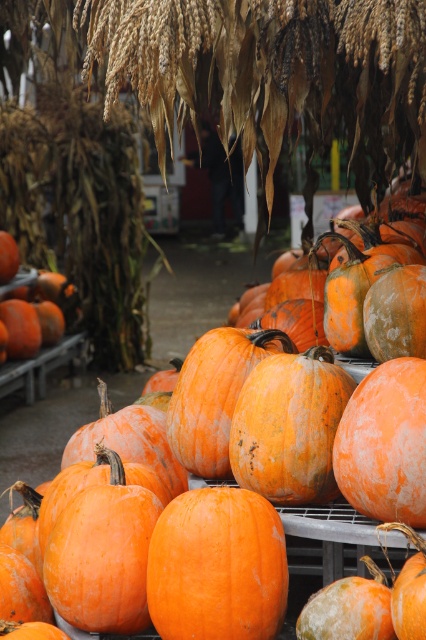
Question: From the image, what is the correct spatial relationship of orange matte pumpkin at center in relation to orange rough pumpkin at center?

Choices:
 (A) left
 (B) right

Answer: (A)

Question: Can you confirm if orange matte pumpkin at center is positioned above orange rough pumpkin at center?

Choices:
 (A) no
 (B) yes

Answer: (B)

Question: Is orange matte pumpkin at center positioned in front of orange rough pumpkin at center?

Choices:
 (A) no
 (B) yes

Answer: (A)

Question: Among these objects, which one is nearest to the camera?

Choices:
 (A) orange rough pumpkin at center
 (B) orange matte pumpkin at center

Answer: (A)